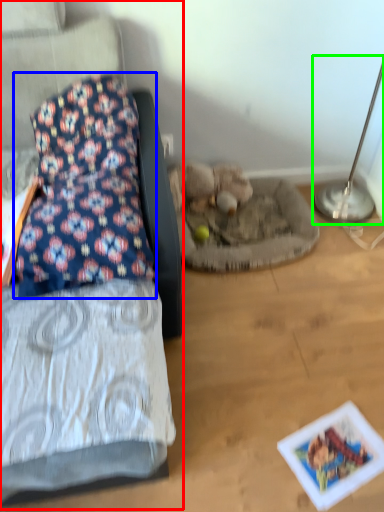
Question: Which is farther away from furniture (highlighted by a red box)? pillow (highlighted by a blue box) or table lamp (highlighted by a green box)?

Choices:
 (A) pillow
 (B) table lamp

Answer: (B)